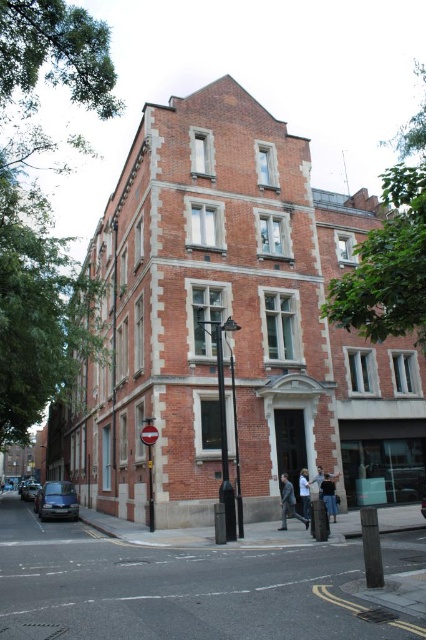
You are a delivery person who needs to park your 1.8 meters tall delivery cart near the building. You see the metallic blue car at lower left and the light gray fabric jacket at center. Which object is taller and should you avoid parking near to ensure enough clearance?

The metallic blue car at lower left is much taller than the light gray fabric jacket at center. You should avoid parking near the metallic blue car at lower left to ensure enough clearance for your delivery cart.

You are a delivery driver who needs to park your metallic blue car at lower left near the building entrance. The parking spot is located at coordinates 0.783, 0.134. Is your car currently in the correct parking spot?

Yes, the metallic blue car at lower left is already positioned at point (57,500), which matches the parking spot coordinates.